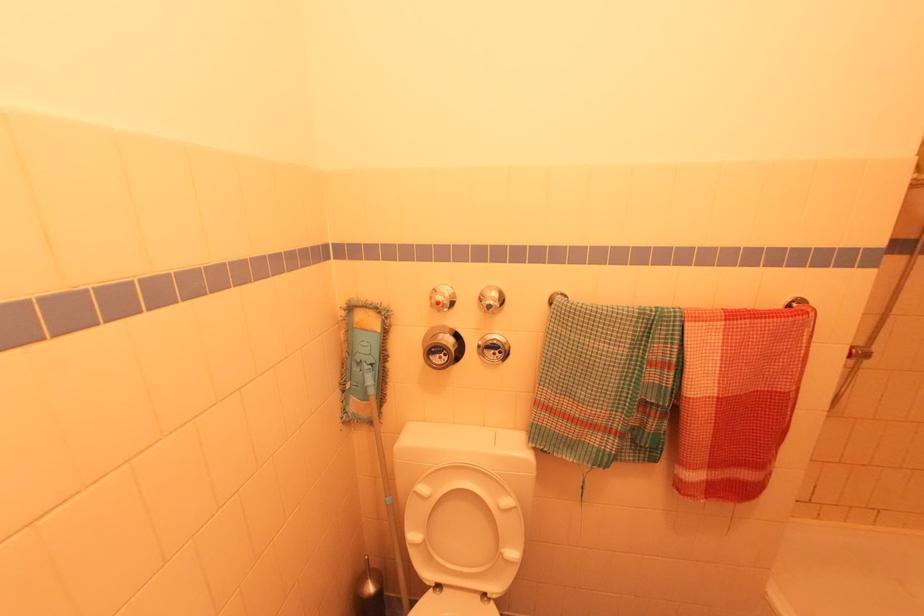
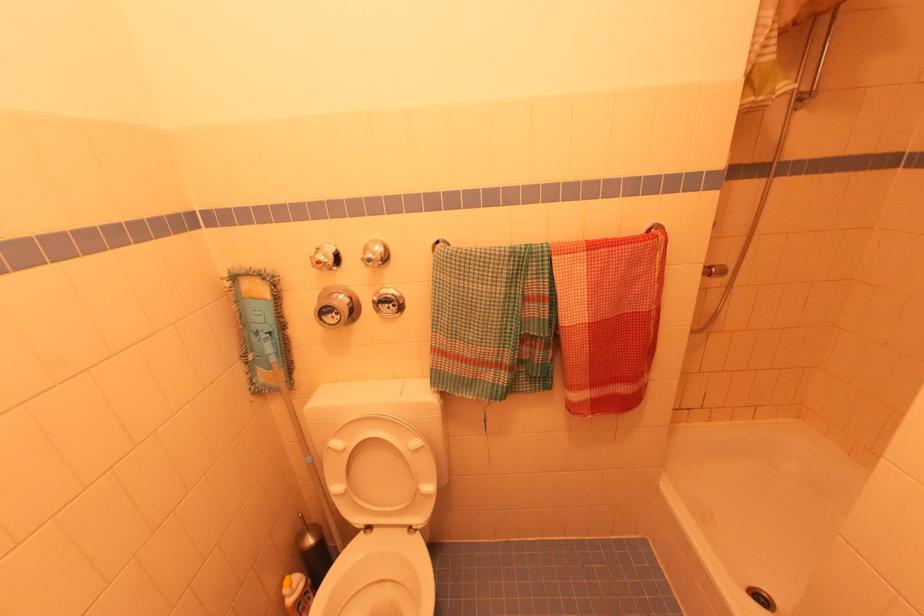
Find the pixel in the second image that matches (x=492, y=288) in the first image.

(377, 243)